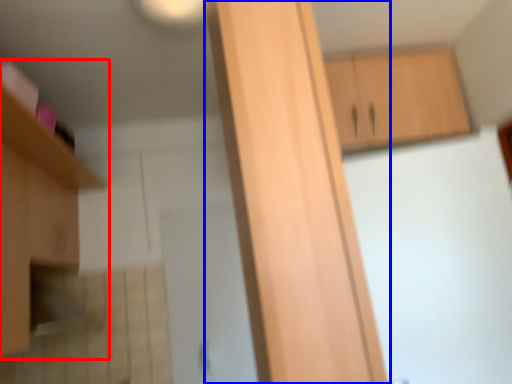
Question: Which object is further to the camera taking this photo, cabinetry (highlighted by a red box) or cabinetry (highlighted by a blue box)?

Choices:
 (A) cabinetry
 (B) cabinetry

Answer: (A)